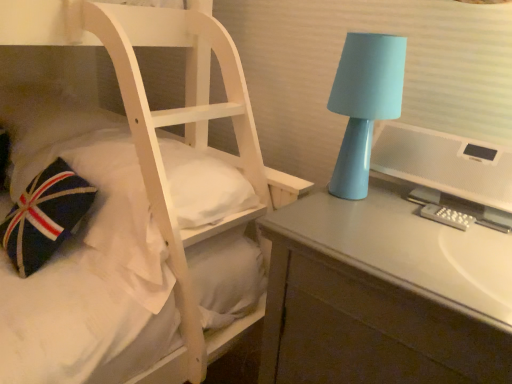
Where is `free spot to the left of white textured computer monitor at right`? The width and height of the screenshot is (512, 384). free spot to the left of white textured computer monitor at right is located at coordinates (348, 220).